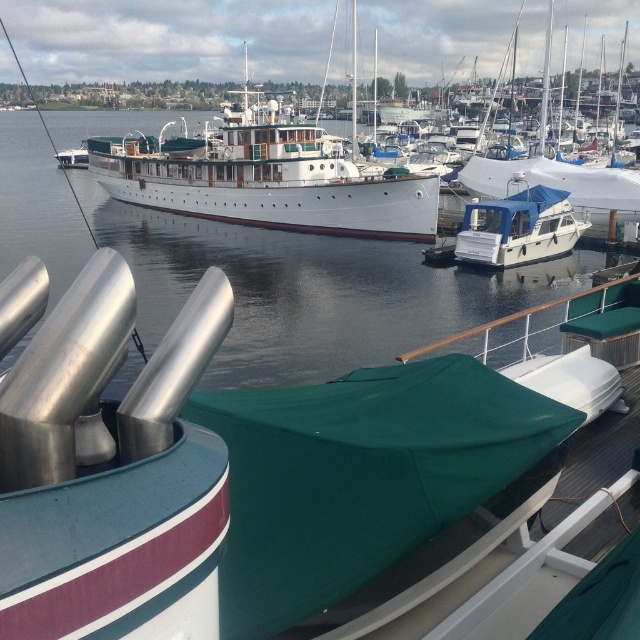
Question: Which object is closer to the camera taking this photo?

Choices:
 (A) white matte sailboat at upper right
 (B) white glossy boat at center

Answer: (B)

Question: Is white polished wood boat at center thinner than white glossy boat at center?

Choices:
 (A) yes
 (B) no

Answer: (B)

Question: Which of the following is the farthest from the observer?

Choices:
 (A) (433, 236)
 (B) (19, 401)
 (C) (561, 218)
 (D) (593, 192)

Answer: (D)

Question: From the image, what is the correct spatial relationship of white polished wood boat at center in relation to white matte sailboat at upper right?

Choices:
 (A) below
 (B) above

Answer: (A)

Question: Does polished stainless steel exhaust pipes at center appear on the right side of white polished wood boat at center?

Choices:
 (A) no
 (B) yes

Answer: (B)

Question: Which point is closer to the camera taking this photo?

Choices:
 (A) (525, 196)
 (B) (280, 200)
 (C) (253, 516)

Answer: (C)